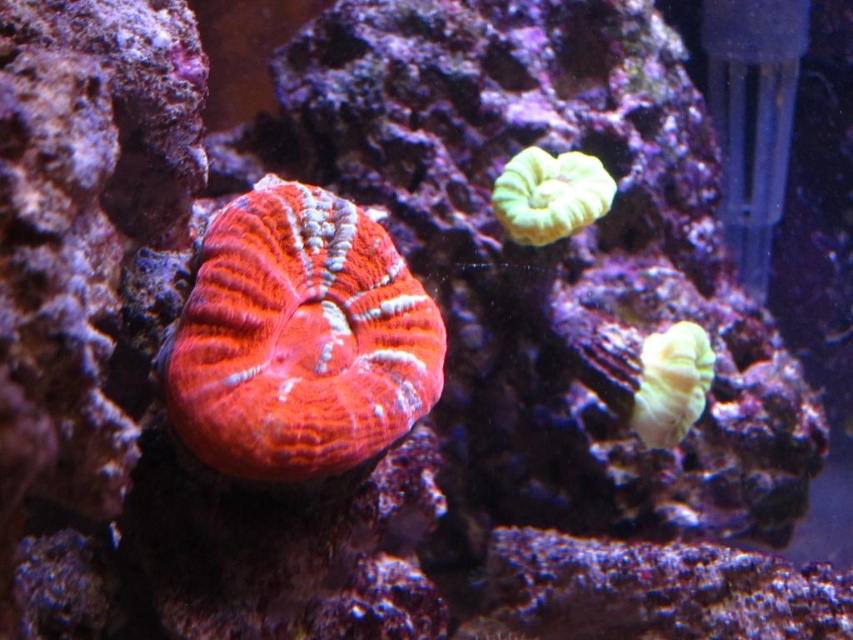
Question: Is green matte coral at upper right thinner than yellow matte coral at right?

Choices:
 (A) no
 (B) yes

Answer: (A)

Question: Among these points, which one is nearest to the camera?

Choices:
 (A) [x=258, y=294]
 (B) [x=606, y=179]
 (C) [x=692, y=378]

Answer: (A)

Question: Is matte coral at center bigger than green matte coral at upper right?

Choices:
 (A) yes
 (B) no

Answer: (A)

Question: Can you confirm if matte coral at center is positioned to the left of green matte coral at upper right?

Choices:
 (A) yes
 (B) no

Answer: (A)

Question: Based on their relative distances, which object is farther from the matte coral at center?

Choices:
 (A) yellow matte coral at right
 (B) green matte coral at upper right

Answer: (A)

Question: Which point appears farthest from the camera in this image?

Choices:
 (A) (614, 188)
 (B) (676, 337)

Answer: (B)